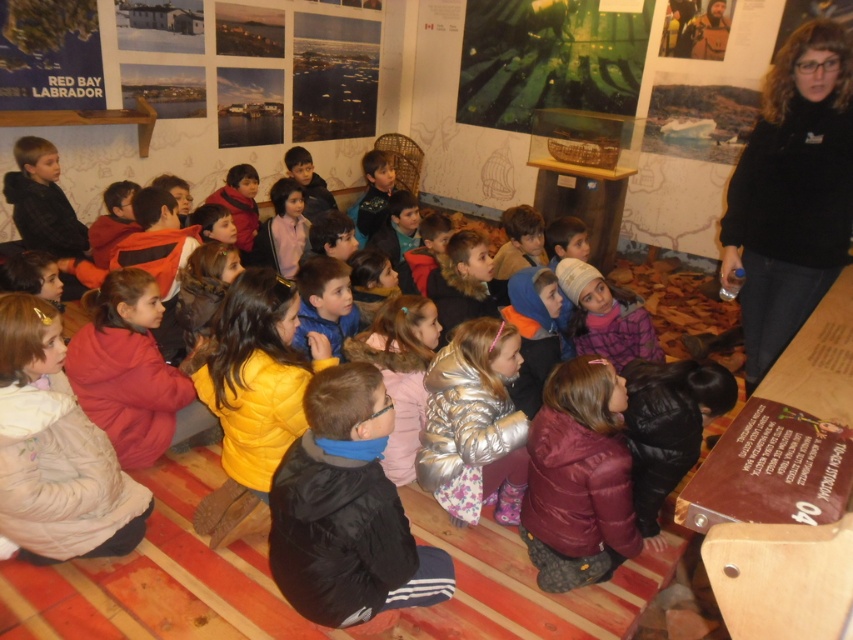
Question: Is black fleece jacket at upper right to the left of burgundy puffy jacket at lower center from the viewer's perspective?

Choices:
 (A) no
 (B) yes

Answer: (A)

Question: Among these points, which one is farthest from the camera?

Choices:
 (A) (264, 221)
 (B) (836, 275)
 (C) (86, 435)

Answer: (A)

Question: Does black puffy jacket at center appear over burgundy puffy jacket at lower center?

Choices:
 (A) no
 (B) yes

Answer: (A)

Question: Which point is closer to the camera?

Choices:
 (A) pink fabric jacket at center
 (B) light beige puffy jacket at lower left

Answer: (B)

Question: Which point appears closest to the camera in this image?

Choices:
 (A) (489, 435)
 (B) (560, 436)

Answer: (B)

Question: Observing the image, what is the correct spatial positioning of black fleece jacket at upper right in reference to metallic silver jacket at center?

Choices:
 (A) right
 (B) left

Answer: (A)